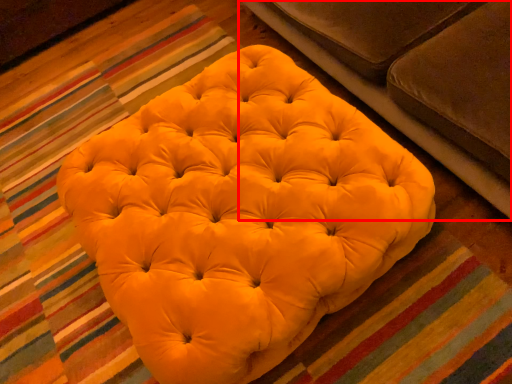
Question: In this image, where is studio couch (annotated by the red box) located relative to furniture?

Choices:
 (A) left
 (B) right

Answer: (B)